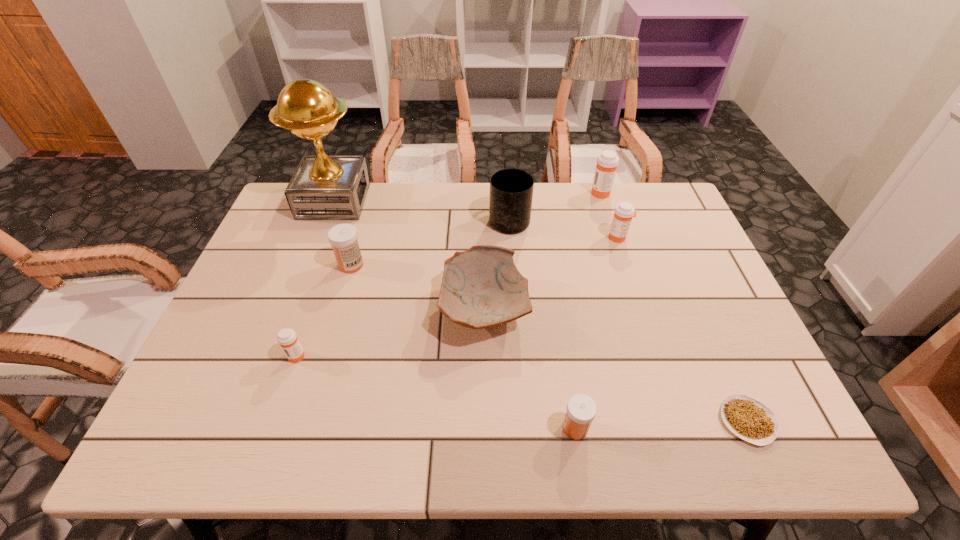
Select which medicine appears as the fifth closest to the pottery. Please provide its 2D coordinates. Your answer should be formatted as a tuple, i.e. [(x, y)], where the tuple contains the x and y coordinates of a point satisfying the conditions above.

[(607, 162)]

Find the location of a particular element. Image resolution: width=960 pixels, height=540 pixels. orange medicine object that ranks as the closest to the fourth object from right to left is located at coordinates (622, 218).

Point out which orange medicine is positioned as the nearest to the smallest orange medicine. Please provide its 2D coordinates. Your answer should be formatted as a tuple, i.e. [(x, y)], where the tuple contains the x and y coordinates of a point satisfying the conditions above.

[(622, 218)]

Identify the location of vacant region that satisfies the following two spatial constraints: 1. on the front-facing side of the award; 2. on the side of the black mug with the handle. (327, 218).